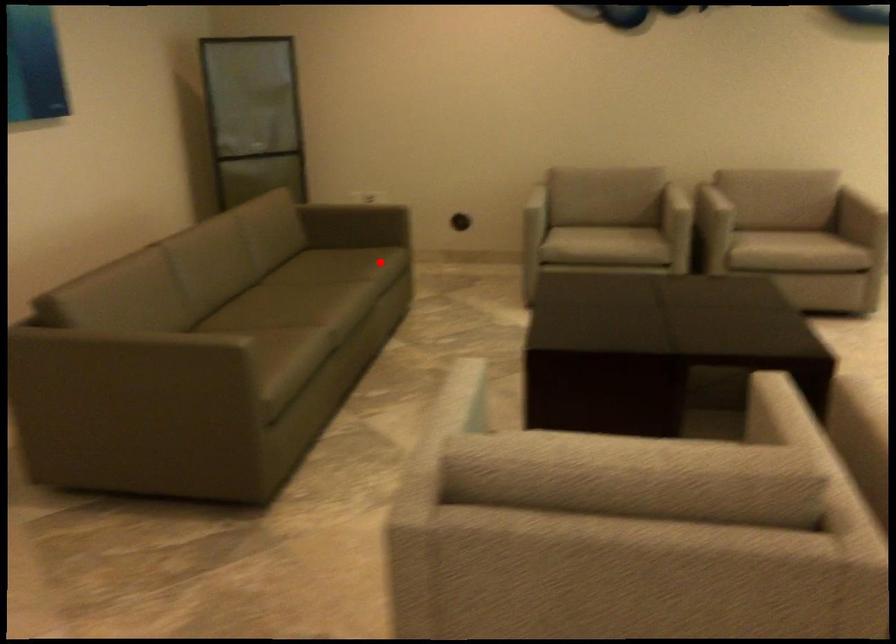
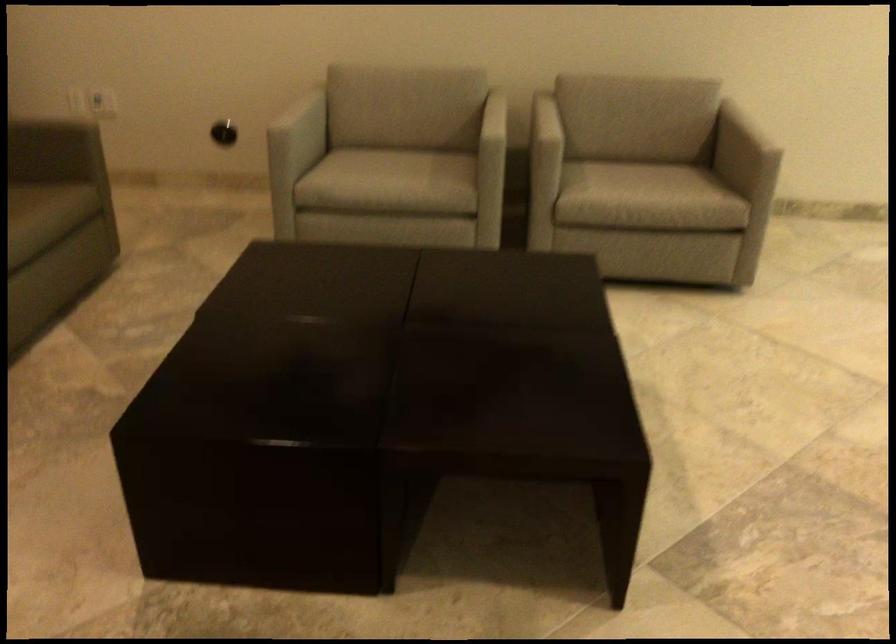
Question: I am providing you with two images of the same scene from different viewpoints. A red point is shown in image1. For the corresponding object point in image2, is it positioned nearer or farther from the camera?

Choices:
 (A) Nearer
 (B) Farther

Answer: (A)